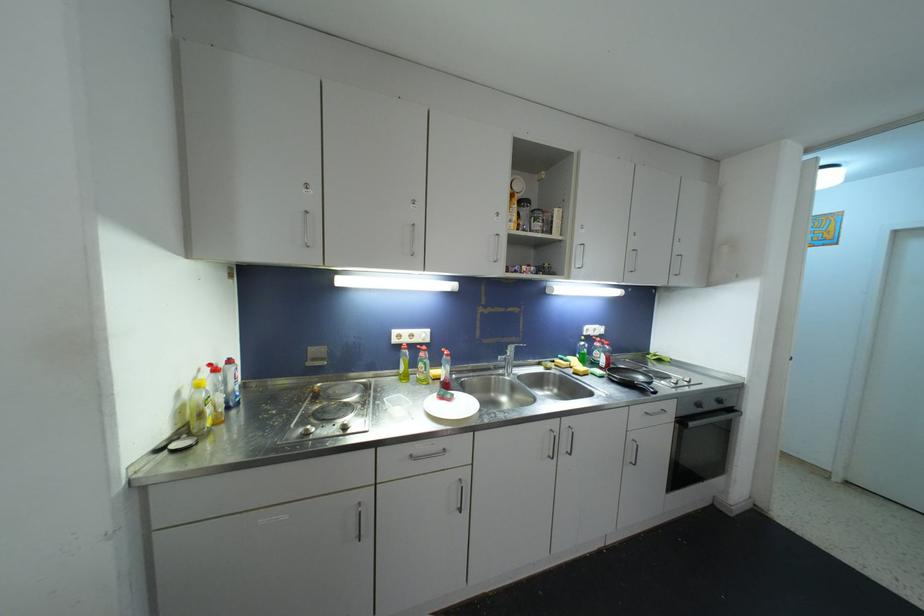
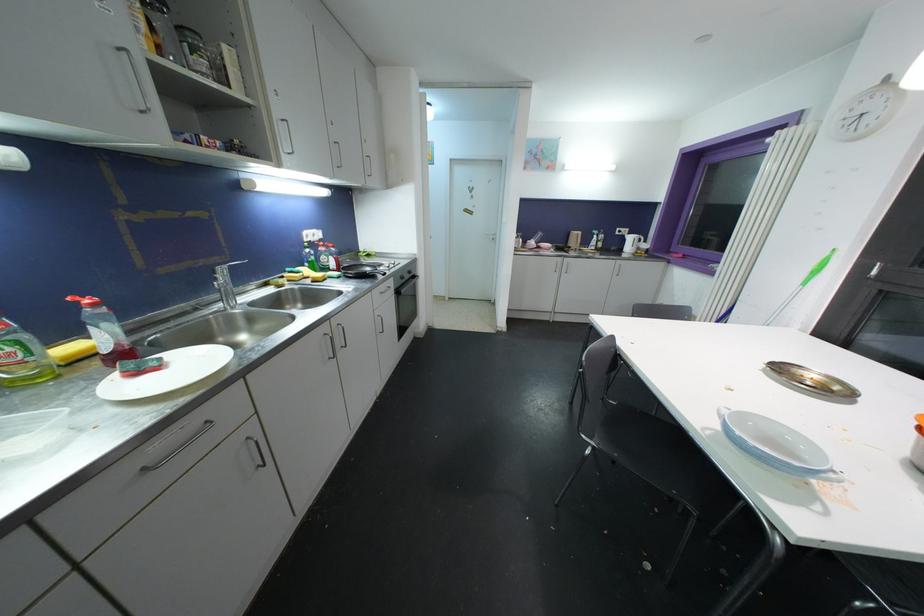
Find the pixel in the second image that matches (447,452) in the first image.

(210, 424)